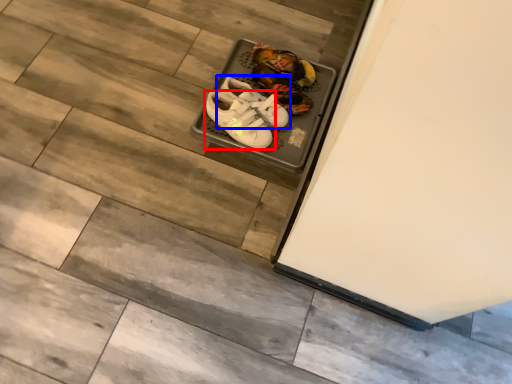
Question: Which object is further to the camera taking this photo, footwear (highlighted by a red box) or footwear (highlighted by a blue box)?

Choices:
 (A) footwear
 (B) footwear

Answer: (B)